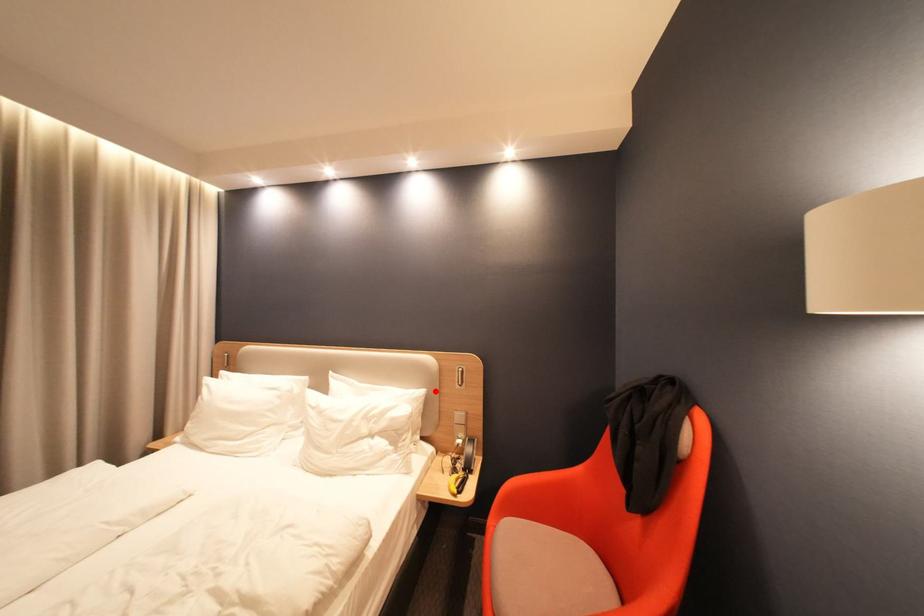
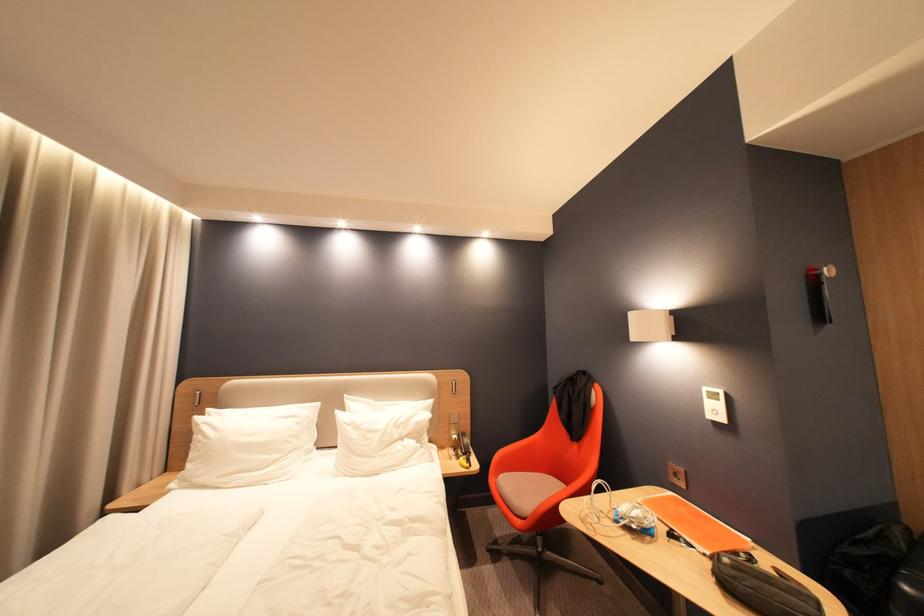
In the second image, find the point that corresponds to the highlighted location in the first image.

(443, 400)